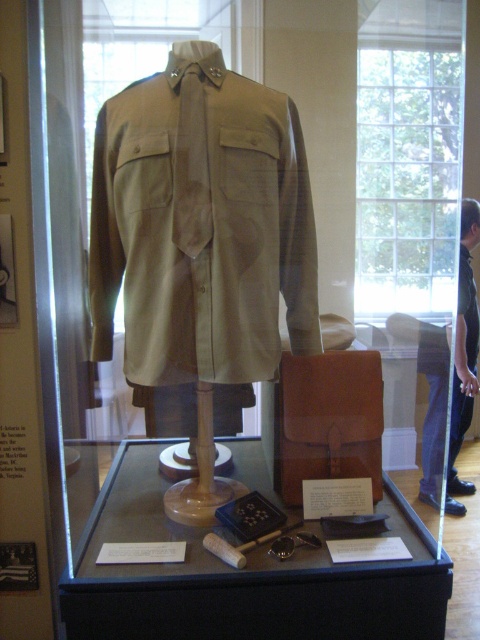
Which is more to the left, khaki cotton shirt at center or black leather pants at lower right?

khaki cotton shirt at center

Which is above, khaki cotton shirt at center or black leather pants at lower right?

khaki cotton shirt at center is higher up.

Is point (191, 67) less distant than point (472, 220)?

That is True.

I want to click on khaki cotton shirt at center, so click(x=201, y=225).

From the picture: Which of these two, khaki cotton shirt at center or matte brown leather case at center, stands shorter?

With less height is matte brown leather case at center.

Can you confirm if khaki cotton shirt at center is wider than matte brown leather case at center?

In fact, khaki cotton shirt at center might be narrower than matte brown leather case at center.

Between point (269, 308) and point (91, 541), which one is positioned in front?

Point (269, 308) is in front.

Find the location of a particular element. Image resolution: width=480 pixels, height=640 pixels. khaki cotton shirt at center is located at coordinates (201, 225).

Looking at this image, which is more to the right, black leather pants at lower right or khaki fabric shirt at center?

Positioned to the right is khaki fabric shirt at center.

This screenshot has height=640, width=480. I want to click on black leather pants at lower right, so click(464, 355).

You are a GUI agent. You are given a task and a screenshot of the screen. Output one action in this format:
    pyautogui.click(x=<x>, y=<y>)
    Task: Click on the black leather pants at lower right
    This screenshot has height=640, width=480.
    Given the screenshot: What is the action you would take?
    pyautogui.click(x=464, y=355)